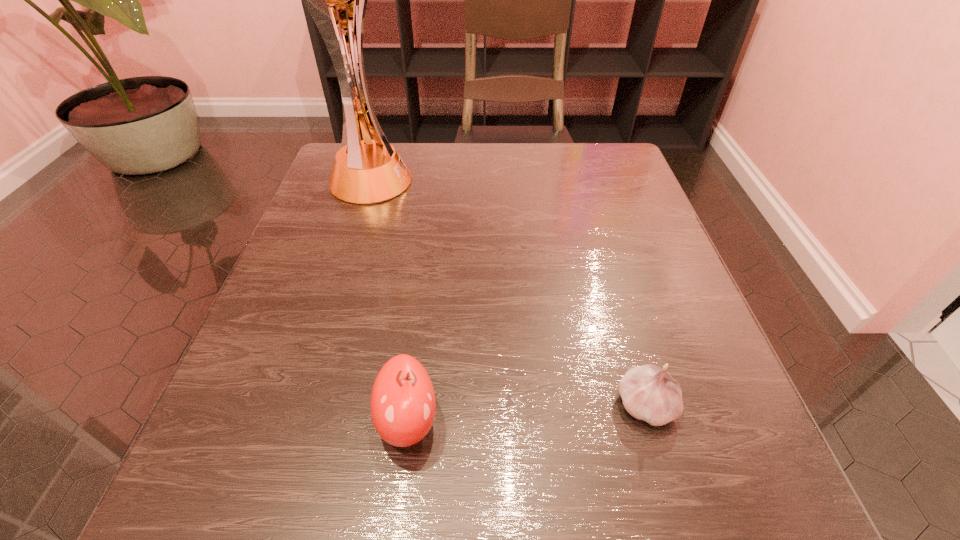
Where is `object present at the right edge`? object present at the right edge is located at coordinates (649, 393).

At what (x,y) coordinates should I click in order to perform the action: click on object that is at the far left corner. Please return your answer as a coordinate pair (x, y). The width and height of the screenshot is (960, 540). Looking at the image, I should click on (370, 171).

Find the location of a particular element. vacant area at the far edge is located at coordinates (417, 146).

Find the location of a particular element. This screenshot has height=540, width=960. free spot at the near edge of the desktop is located at coordinates (625, 509).

I want to click on vacant space at the left edge of the desktop, so click(339, 280).

What are the coordinates of `vacant region at the right edge of the desktop` in the screenshot? It's located at (596, 199).

Locate an element on the screen. vacant space at the near left corner of the desktop is located at coordinates (247, 475).

I want to click on unoccupied position between the garlic and the leftmost object, so click(507, 294).

The image size is (960, 540). Identify the location of free space between the tallest object and the second object from left to right. pos(388,301).

At what (x,y) coordinates should I click in order to perform the action: click on vacant space that's between the rightmost object and the farthest object. Please return your answer as a coordinate pair (x, y). The height and width of the screenshot is (540, 960). Looking at the image, I should click on [x=507, y=294].